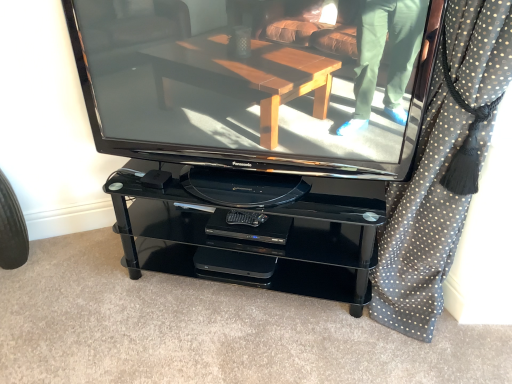
At what (x,y) coordinates should I click in order to perform the action: click on vacant point to the right of black rubber tire at lower left. Please return your answer as a coordinate pair (x, y). This screenshot has height=384, width=512. Looking at the image, I should click on (53, 269).